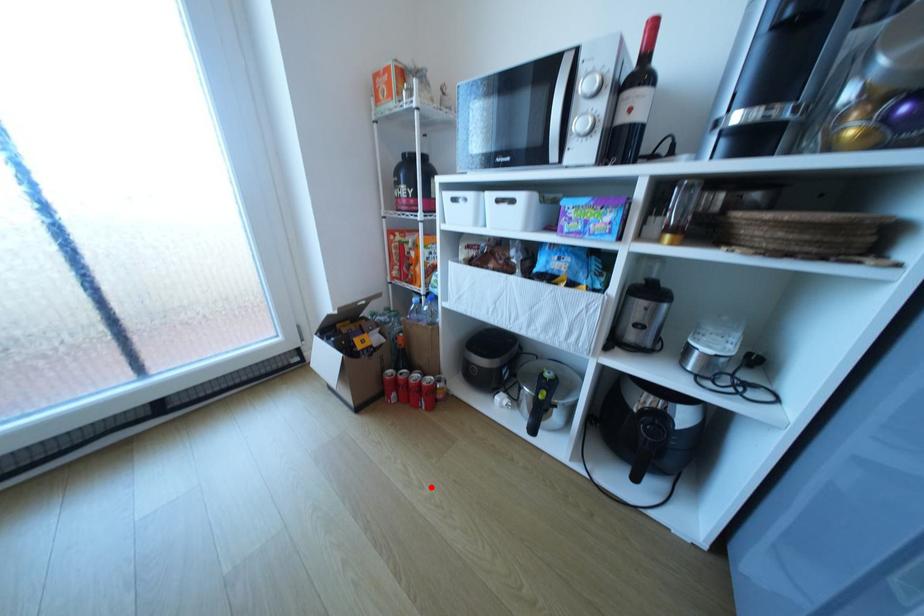
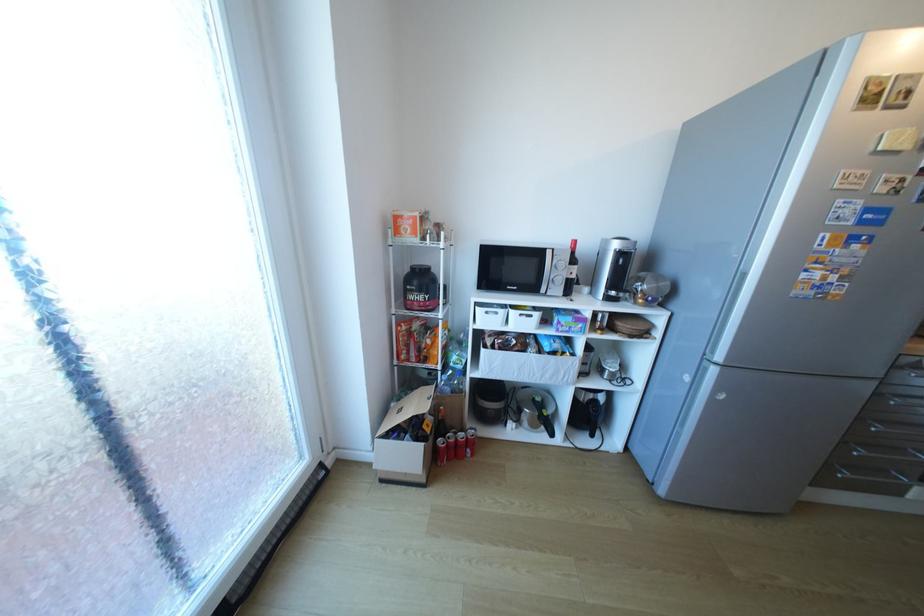
In the second image, find the point that corresponds to the highlighted location in the first image.

(523, 504)